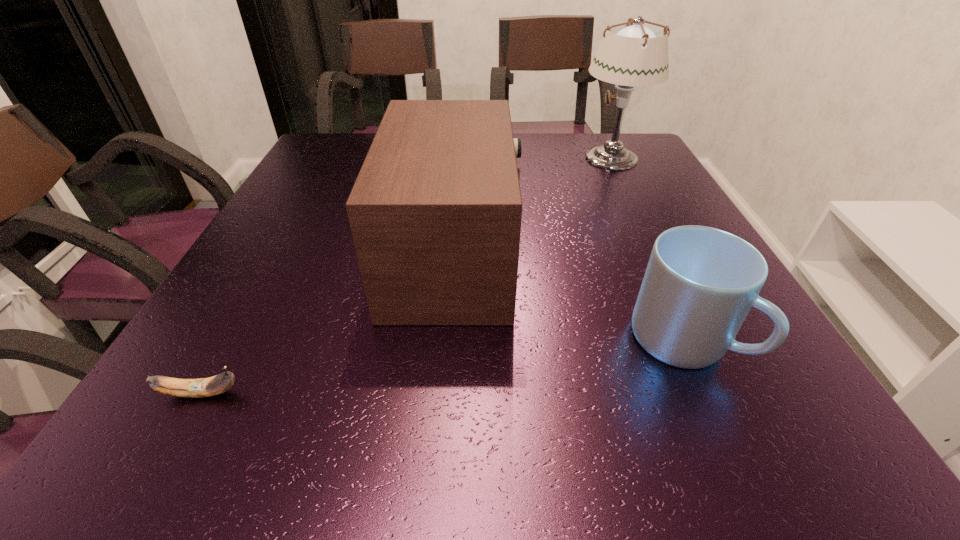
This screenshot has height=540, width=960. In order to click on the tallest object in this screenshot , I will do `click(632, 54)`.

This screenshot has height=540, width=960. What are the coordinates of `lampshade` in the screenshot? It's located at (632, 54).

The width and height of the screenshot is (960, 540). What are the coordinates of `radio receiver` in the screenshot? It's located at (435, 213).

Image resolution: width=960 pixels, height=540 pixels. What are the coordinates of `the second object from left to right` in the screenshot? It's located at (435, 213).

I want to click on mug, so click(x=700, y=283).

I want to click on the shortest object, so click(202, 387).

You are a GUI agent. You are given a task and a screenshot of the screen. Output one action in this format:
    pyautogui.click(x=<x>, y=<y>)
    Task: Click on the leftmost object
    The height and width of the screenshot is (540, 960).
    Given the screenshot: What is the action you would take?
    pyautogui.click(x=202, y=387)

Locate an element on the screen. free space located on the lampshade of the tallest object is located at coordinates (552, 158).

Locate an element on the screen. The image size is (960, 540). vacant space located 0.380m on the lampshade of the tallest object is located at coordinates (442, 158).

Image resolution: width=960 pixels, height=540 pixels. Find the location of `vacant position located 0.280m on the lampshade of the tallest object`. vacant position located 0.280m on the lampshade of the tallest object is located at coordinates (477, 158).